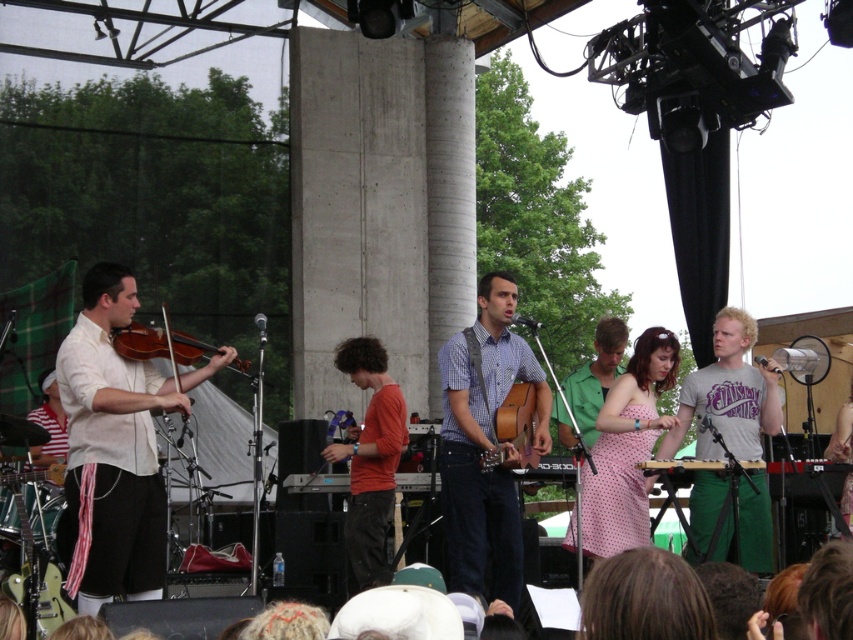
Question: Can you confirm if matte white shirt at left is wider than green cotton pants at center?

Choices:
 (A) no
 (B) yes

Answer: (B)

Question: Which of the following is the closest to the observer?

Choices:
 (A) matte brown violin at left
 (B) checkered fabric shirt at center
 (C) orange cotton shirt at center
 (D) green cotton pants at center

Answer: (A)

Question: Which of the following is the farthest from the observer?

Choices:
 (A) checkered fabric shirt at center
 (B) matte white shirt at left

Answer: (A)

Question: Can you confirm if checkered fabric shirt at center is thinner than matte brown violin at left?

Choices:
 (A) no
 (B) yes

Answer: (A)

Question: Is orange cotton shirt at center to the right of brown wooden guitar at center from the viewer's perspective?

Choices:
 (A) yes
 (B) no

Answer: (B)

Question: Which is farther from the brown wooden guitar at center?

Choices:
 (A) green cotton pants at center
 (B) checkered fabric shirt at center
 (C) matte white shirt at left

Answer: (C)